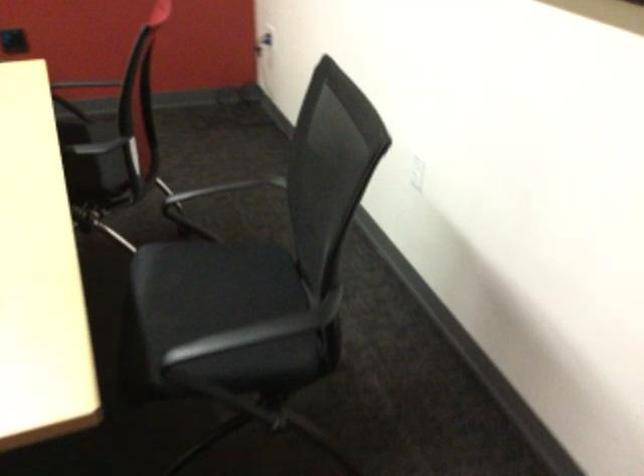
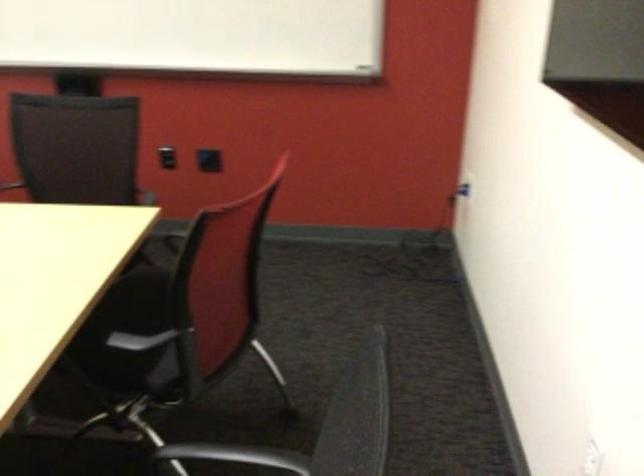
In the second image, find the point that corresponds to point (122, 192) in the first image.

(169, 381)